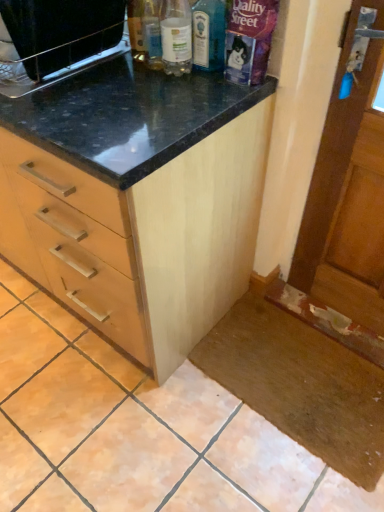
The image size is (384, 512). In order to click on vacant space that is in between clear plastic bottle at upper center, the second bottle positioned from the right, and black matte microwave at upper left in this screenshot , I will do `click(110, 79)`.